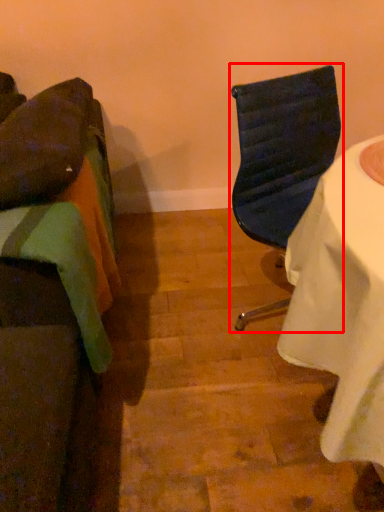
Question: From the image's perspective, what is the correct spatial positioning of chair (annotated by the red box) in reference to chair?

Choices:
 (A) above
 (B) below

Answer: (A)